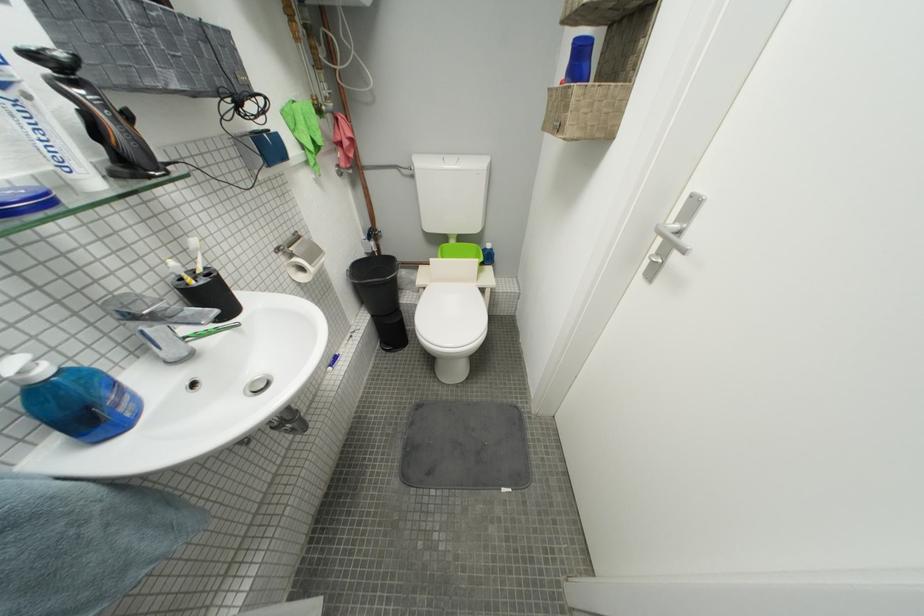
What do you see at coordinates (462, 290) in the screenshot? I see `a white toilet seat` at bounding box center [462, 290].